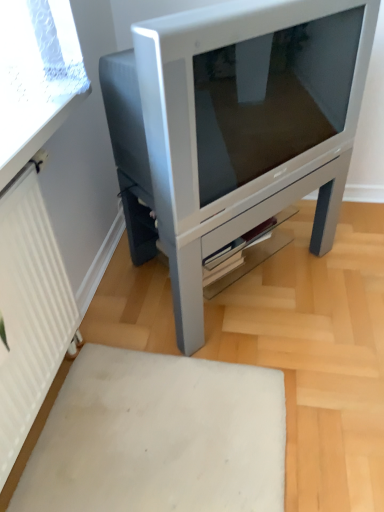
Locate an element on the screen. The image size is (384, 512). vacant space to the right of white ribbed radiator at left is located at coordinates (158, 397).